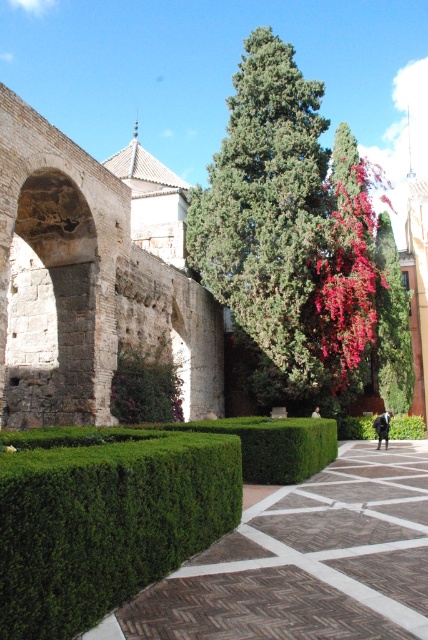
Can you confirm if green leafy hedge at center is positioned to the right of green textured tree at center?

No, green leafy hedge at center is not to the right of green textured tree at center.

Who is more forward, (192,522) or (272,180)?

Positioned in front is point (192,522).

Who is more distant from viewer, (77, 442) or (205, 257)?

The point (205, 257) is behind.

At what (x,y) coordinates should I click in order to perform the action: click on green leafy hedge at center. Please return your answer as a coordinate pair (x, y). This screenshot has height=640, width=428. Looking at the image, I should click on (104, 518).

Can you confirm if green hedge at lower left is bigger than green textured tree at center?

Incorrect, green hedge at lower left is not larger than green textured tree at center.

Between point (165, 618) and point (315, 221), which one is positioned behind?

Positioned behind is point (315, 221).

What do you see at coordinates (306, 561) in the screenshot? Image resolution: width=428 pixels, height=640 pixels. I see `green hedge at lower left` at bounding box center [306, 561].

Identify the location of green hedge at lower left. This screenshot has height=640, width=428. (306, 561).

Is green hedge at lower left closer to the viewer compared to green leafy hedge at center?

No, it is behind green leafy hedge at center.

Who is more distant from viewer, (344, 506) or (68, 600)?

Positioned behind is point (344, 506).

Who is more distant from viewer, (392, 604) or (148, 538)?

The point (148, 538) is behind.

Identify the location of green hedge at lower left. (306, 561).